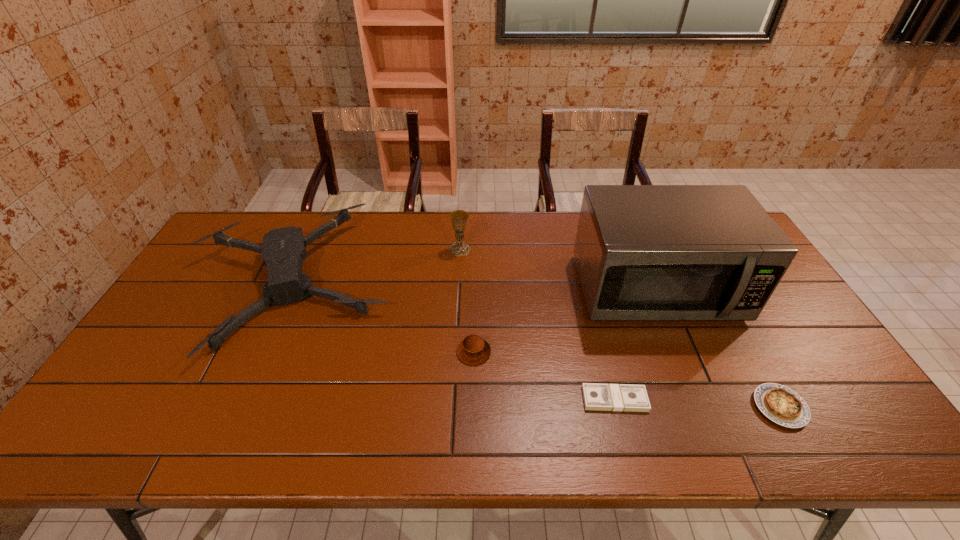
The image size is (960, 540). I want to click on the tallest object, so click(643, 252).

Where is `chalice`? chalice is located at coordinates [x=459, y=218].

At what (x,y) coordinates should I click in order to perform the action: click on drone. Please return your answer as a coordinate pair (x, y). This screenshot has width=960, height=540. Looking at the image, I should click on (283, 250).

I want to click on the leftmost object, so click(283, 250).

Find the location of `muffin`. muffin is located at coordinates 473,350.

At what (x,y) coordinates should I click in order to perform the action: click on quiche. Please return your answer as a coordinate pair (x, y). The width and height of the screenshot is (960, 540). Looking at the image, I should click on (779, 403).

In order to click on dollar in this screenshot , I will do `click(604, 397)`.

Identify the location of vacant area located on the front-facing side of the microwave oven. (684, 355).

This screenshot has width=960, height=540. In order to click on vacant position located on the front of the second tallest object in this screenshot , I will do `click(458, 293)`.

Identify the location of vacant region located on the front of the leftmost object. The image size is (960, 540). (220, 449).